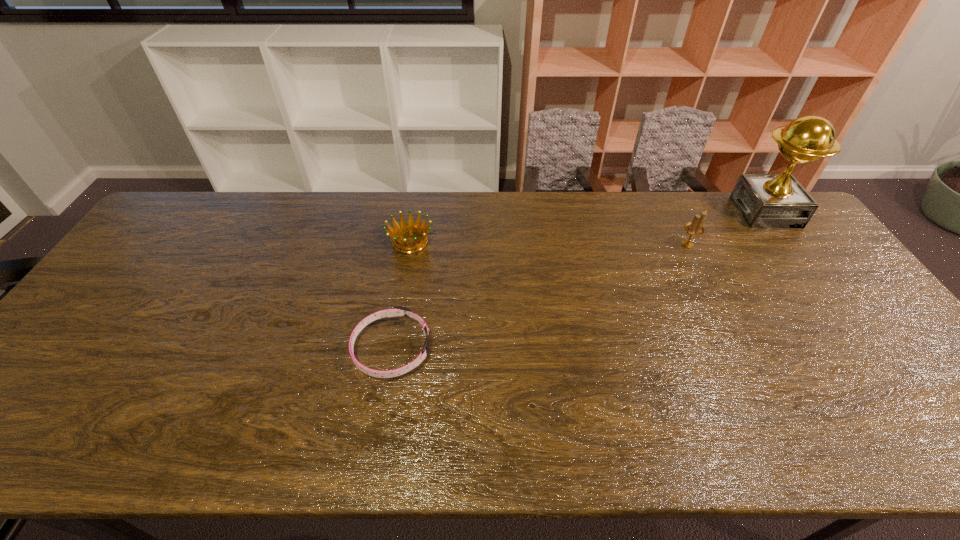
The width and height of the screenshot is (960, 540). Identify the location of free spot between the crown and the rightmost object. (588, 227).

Locate an element on the screen. free point between the award and the third shortest object is located at coordinates (727, 228).

Locate which object is the closest to the third object from left to right. Please provide its 2D coordinates. Your answer should be formatted as a tuple, i.e. [(x, y)], where the tuple contains the x and y coordinates of a point satisfying the conditions above.

[(765, 200)]

You are a GUI agent. You are given a task and a screenshot of the screen. Output one action in this format:
    pyautogui.click(x=<x>, y=<y>)
    Task: Click on the object that is the third closest to the shortest object
    This screenshot has height=540, width=960.
    Given the screenshot: What is the action you would take?
    pyautogui.click(x=765, y=200)

The width and height of the screenshot is (960, 540). What are the coordinates of `free space that satisfies the following two spatial constraints: 1. on the front side of the third tallest object; 2. on the left side of the second object from right to left` in the screenshot? It's located at (410, 245).

You are a GUI agent. You are given a task and a screenshot of the screen. Output one action in this format:
    pyautogui.click(x=<x>, y=<y>)
    Task: Click on the blank space that satisfies the following two spatial constraints: 1. on the front-facing side of the rightmost object; 2. on the front side of the third tallest object
    The image size is (960, 540).
    Given the screenshot: What is the action you would take?
    pyautogui.click(x=787, y=242)

Find the location of a particular element. Image resolution: width=960 pixels, height=540 pixels. vacant point that satisfies the following two spatial constraints: 1. on the front side of the third shortest object; 2. with the buckle on the dog collar is located at coordinates (738, 349).

Locate an element on the screen. Image resolution: width=960 pixels, height=540 pixels. vacant space that satisfies the following two spatial constraints: 1. on the front-facing side of the award; 2. on the front side of the crown is located at coordinates coord(787,242).